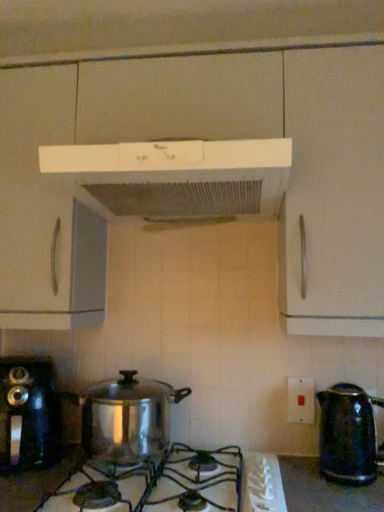
From the picture: In order to face white matte range hood at upper center, should I rotate leftwards or rightwards?

It's best to rotate left around 1.970 degrees.

Describe the element at coordinates (127, 418) in the screenshot. I see `stainless steel pot at center` at that location.

What do you see at coordinates (176, 485) in the screenshot?
I see `shiny metallic gas stove at center` at bounding box center [176, 485].

Locate an element on the screen. This screenshot has width=384, height=512. white plastic switch at center-right is located at coordinates (301, 400).

Is point (348, 384) farther from viewer compared to point (157, 142)?

Yes, it is.

Is there a large distance between shiny black kettle at right and white matte range hood at upper center?

shiny black kettle at right is near white matte range hood at upper center, not far away.

Based on the photo, from the image's perspective, between shiny black kettle at right and white matte range hood at upper center, which one is located above?

white matte range hood at upper center appears higher in the image.

How many degrees apart are the facing directions of shiny black kettle at right and white matte range hood at upper center?

0.472 degrees separate the facing orientations of shiny black kettle at right and white matte range hood at upper center.

Can you tell me how much shiny metallic gas stove at center and shiny black coffee maker at left differ in facing direction?

The facing directions of shiny metallic gas stove at center and shiny black coffee maker at left are 0.311 degrees apart.

Between shiny metallic gas stove at center and shiny black coffee maker at left, which one has larger size?

Bigger between the two is shiny black coffee maker at left.

In the image, is shiny metallic gas stove at center positioned in front of or behind shiny black coffee maker at left?

In the image, shiny metallic gas stove at center appears in front of shiny black coffee maker at left.

In the scene shown: From the image's perspective, which is above, shiny metallic gas stove at center or shiny black coffee maker at left?

shiny black coffee maker at left appears higher in the image.

Can you confirm if shiny black coffee maker at left is taller than white plastic switch at center-right?

Correct, shiny black coffee maker at left is much taller as white plastic switch at center-right.

Is shiny black coffee maker at left aimed at white plastic switch at center-right?

No, shiny black coffee maker at left does not turn towards white plastic switch at center-right.

From the image's perspective, which one is positioned higher, shiny black coffee maker at left or white plastic switch at center-right?

white plastic switch at center-right, from the image's perspective.

Which is closer to the camera, (7, 469) or (310, 388)?

Positioned in front is point (7, 469).

Is stainless steel pot at center far away from white plastic switch at center-right?

No.

From the picture: Which object is thinner, stainless steel pot at center or white plastic switch at center-right?

white plastic switch at center-right.

Is stainless steel pot at center spatially inside white plastic switch at center-right, or outside of it?

stainless steel pot at center is outside white plastic switch at center-right.

In the scene shown: From a real-world perspective, which object stands above the other?

white plastic switch at center-right.

From the picture: From a real-world perspective, which is physically below, stainless steel pot at center or shiny black kettle at right?

In real-world perspective, shiny black kettle at right is lower.

From the image's perspective, does stainless steel pot at center appear lower than shiny black kettle at right?

Incorrect, from the image's perspective, stainless steel pot at center is higher than shiny black kettle at right.

Is stainless steel pot at center facing towards shiny black kettle at right?

No, stainless steel pot at center is not facing towards shiny black kettle at right.

How many degrees apart are the facing directions of stainless steel pot at center and shiny black kettle at right?

The angle between the facing direction of stainless steel pot at center and the facing direction of shiny black kettle at right is 0.961 degrees.

Considering the relative sizes of shiny black kettle at right and shiny metallic gas stove at center in the image provided, is shiny black kettle at right wider than shiny metallic gas stove at center?

No, shiny black kettle at right is not wider than shiny metallic gas stove at center.

From the image's perspective, between shiny black kettle at right and shiny metallic gas stove at center, who is located below?

From the image's view, shiny metallic gas stove at center is below.

Locate an element on the screen. Image resolution: width=384 pixels, height=512 pixels. gas stove lying below the shiny black kettle at right (from the image's perspective) is located at coordinates (176, 485).

Is shiny black kettle at right at the right side of shiny metallic gas stove at center?

Yes, shiny black kettle at right is to the right of shiny metallic gas stove at center.

The image size is (384, 512). I want to click on kitchen appliance lying above the shiny black kettle at right (from the image's perspective), so click(27, 413).

Can you confirm if shiny black coffee maker at left is positioned to the left of shiny black kettle at right?

Correct, you'll find shiny black coffee maker at left to the left of shiny black kettle at right.

Is shiny black kettle at right at the back of shiny black coffee maker at left?

shiny black coffee maker at left is not turned away from shiny black kettle at right.

Does shiny black coffee maker at left have a greater width compared to shiny black kettle at right?

Indeed, shiny black coffee maker at left has a greater width compared to shiny black kettle at right.

You are a GUI agent. You are given a task and a screenshot of the screen. Output one action in this format:
    pyautogui.click(x=<x>, y=<y>)
    Task: Click on the kettle lying behind the white matte range hood at upper center
    The height and width of the screenshot is (512, 384).
    Given the screenshot: What is the action you would take?
    pyautogui.click(x=348, y=434)

You are a GUI agent. You are given a task and a screenshot of the screen. Output one action in this format:
    pyautogui.click(x=<x>, y=<y>)
    Task: Click on the gas stove below the shiny black coffee maker at left (from a real-world perspective)
    This screenshot has height=512, width=384.
    Given the screenshot: What is the action you would take?
    pyautogui.click(x=176, y=485)

Looking at the image, which one is located further to shiny black kettle at right, stainless steel pot at center or shiny metallic gas stove at center?

Based on the image, stainless steel pot at center appears to be further to shiny black kettle at right.

Estimate the real-world distances between objects in this image. Which object is closer to shiny black coffee maker at left, white plastic switch at center-right or shiny metallic gas stove at center?

shiny metallic gas stove at center.

Estimate the real-world distances between objects in this image. Which object is closer to shiny black coffee maker at left, white matte range hood at upper center or shiny black kettle at right?

white matte range hood at upper center.

Looking at the image, which one is located closer to stainless steel pot at center, white matte range hood at upper center or shiny black kettle at right?

shiny black kettle at right.

Considering their positions, is white plastic switch at center-right positioned closer to shiny black kettle at right than shiny black coffee maker at left?

white plastic switch at center-right is closer to shiny black kettle at right.

When comparing their distances from shiny metallic gas stove at center, does white plastic switch at center-right or shiny black coffee maker at left seem closer?

shiny black coffee maker at left is closer to shiny metallic gas stove at center.

When comparing their distances from stainless steel pot at center, does shiny black coffee maker at left or shiny metallic gas stove at center seem closer?

Among the two, shiny metallic gas stove at center is located nearer to stainless steel pot at center.

Which object lies further to the anchor point white matte range hood at upper center, shiny black kettle at right or shiny black coffee maker at left?

shiny black kettle at right is positioned further to the anchor white matte range hood at upper center.

Identify the location of electric outlet between shiny metallic gas stove at center and shiny black kettle at right. The width and height of the screenshot is (384, 512). (301, 400).

The image size is (384, 512). I want to click on electric outlet between white matte range hood at upper center and shiny metallic gas stove at center in the up-down direction, so click(301, 400).

Where is `crock pot between white matte range hood at upper center and shiny black kettle at right vertically`? crock pot between white matte range hood at upper center and shiny black kettle at right vertically is located at coordinates (127, 418).

The width and height of the screenshot is (384, 512). Identify the location of kitchen appliance between white matte range hood at upper center and shiny metallic gas stove at center in the vertical direction. click(27, 413).